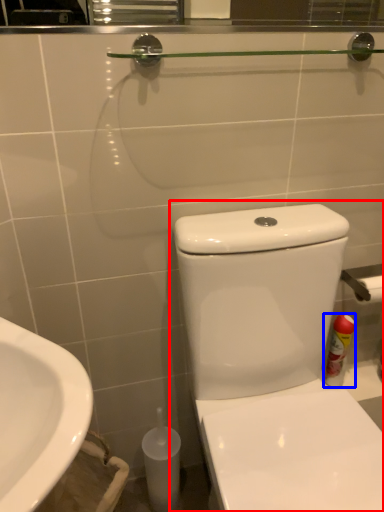
Question: Which of the following is the farthest to the observer, toilet (highlighted by a red box) or cleaning product (highlighted by a blue box)?

Choices:
 (A) toilet
 (B) cleaning product

Answer: (B)